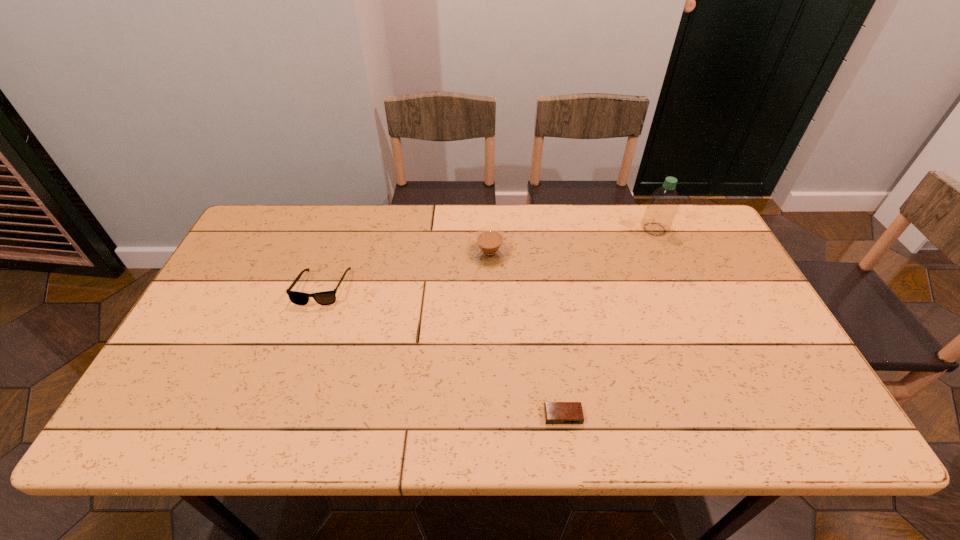
The height and width of the screenshot is (540, 960). I want to click on object that is the second closest one to the third object from right to left, so click(x=663, y=204).

Identify which object is the nearest to the third nearest object. Please provide its 2D coordinates. Your answer should be formatted as a tuple, i.e. [(x, y)], where the tuple contains the x and y coordinates of a point satisfying the conditions above.

[(326, 297)]